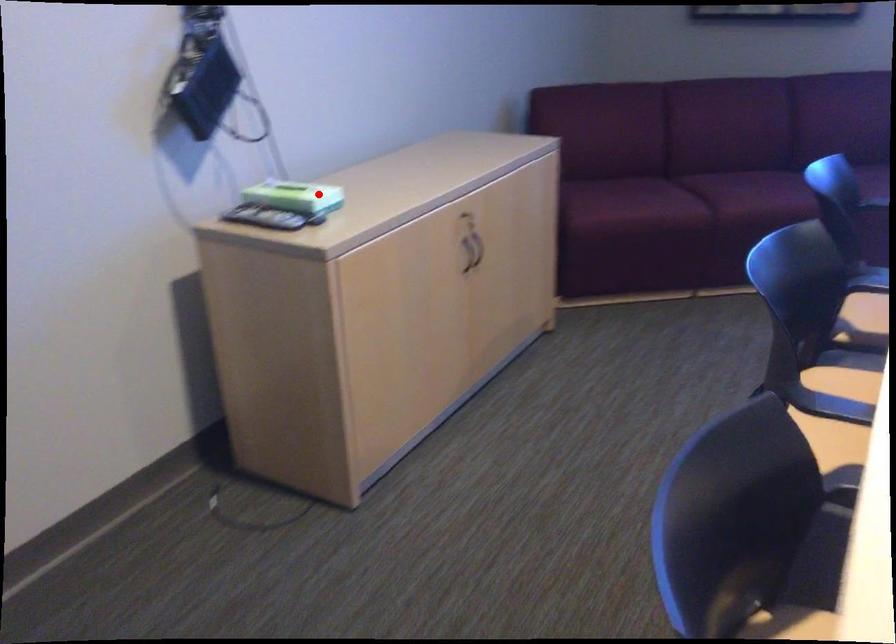
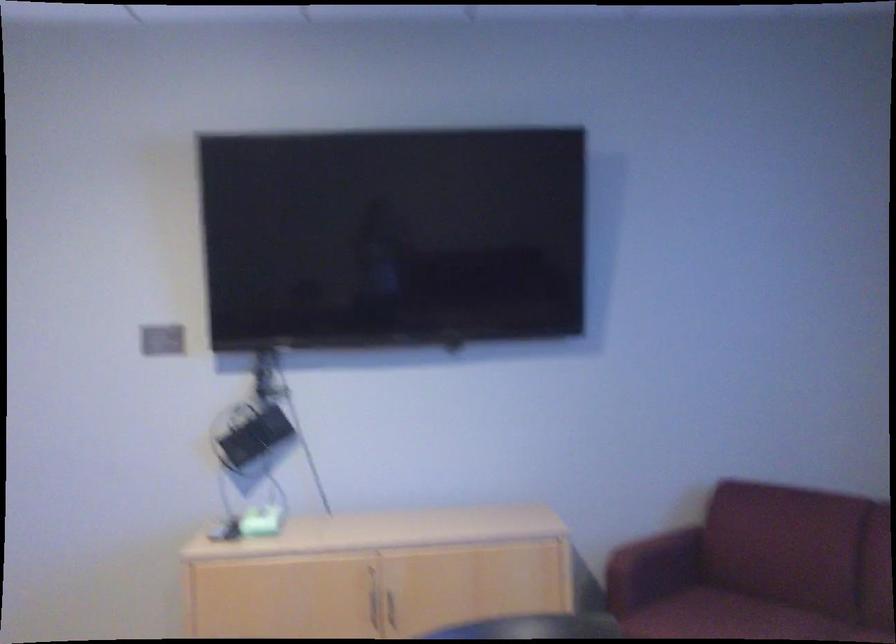
Find the pixel in the second image that matches the highlighted location in the first image.

(257, 522)